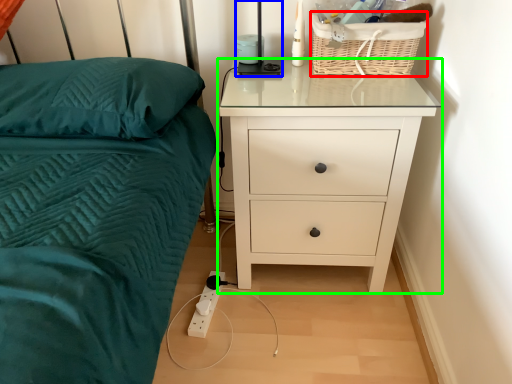
Question: Estimate the real-world distances between objects in this image. Which object is farther from basket (highlighted by a red box), bedside lamp (highlighted by a blue box) or chest of drawers (highlighted by a green box)?

Choices:
 (A) bedside lamp
 (B) chest of drawers

Answer: (B)